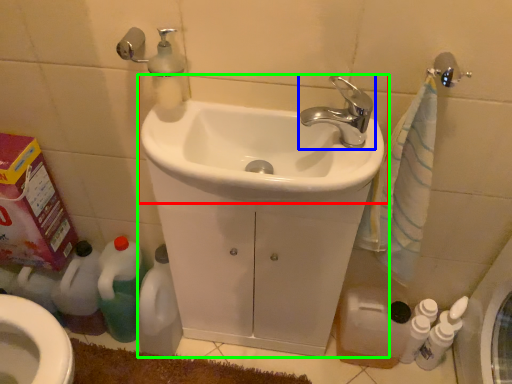
Question: Based on their relative distances, which object is nearer to sink (highlighted by a red box)? Choose from tap (highlighted by a blue box) and sink (highlighted by a green box).

Choices:
 (A) tap
 (B) sink

Answer: (B)